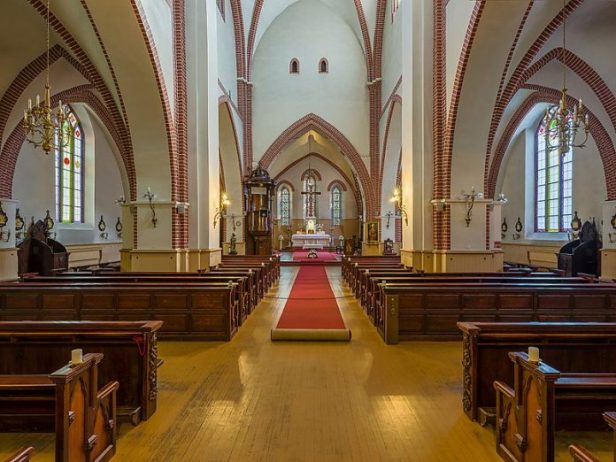
Locate an element on the screen. The height and width of the screenshot is (462, 616). white wall is located at coordinates (477, 118).